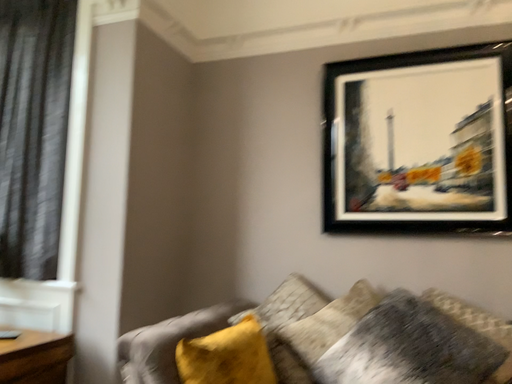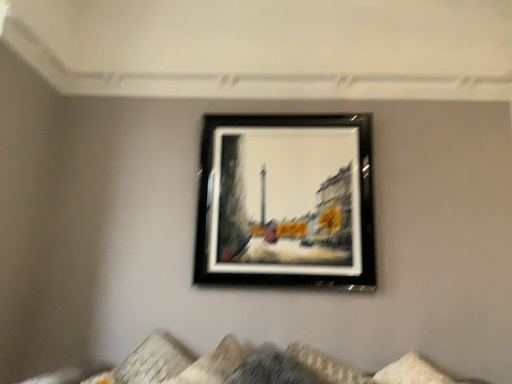
Question: Which way did the camera rotate in the video?

Choices:
 (A) rotated right
 (B) rotated left

Answer: (A)